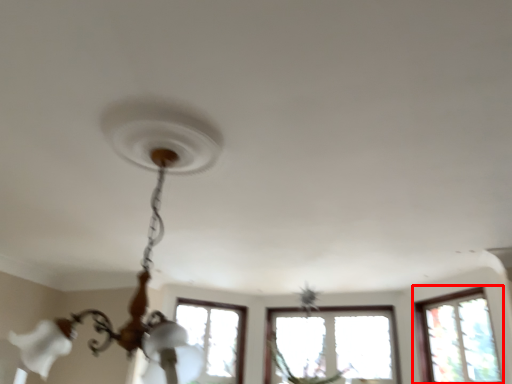
Question: Where is window (annotated by the red box) located in relation to lamp in the image?

Choices:
 (A) left
 (B) right

Answer: (B)